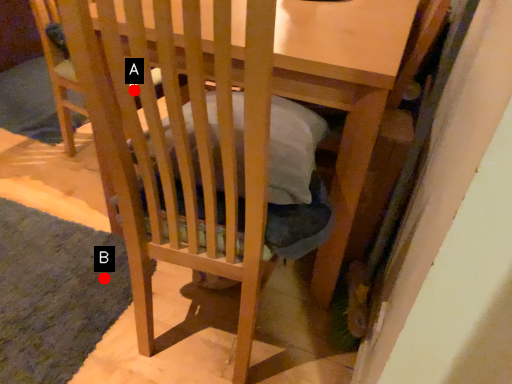
Question: Two points are circled on the image, labeled by A and B beside each circle. Which point is further to the camera?

Choices:
 (A) A is further
 (B) B is further

Answer: (B)